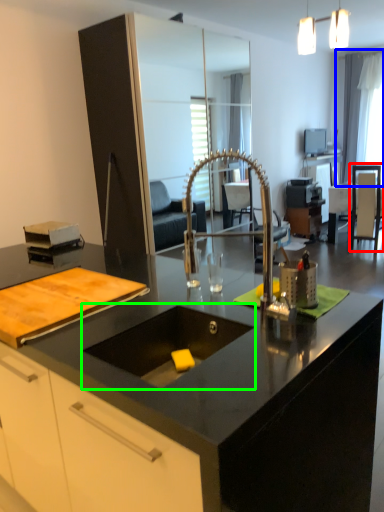
Question: Which is farther away from armchair (highlighted by a red box)? window screen (highlighted by a blue box) or sink (highlighted by a green box)?

Choices:
 (A) window screen
 (B) sink

Answer: (B)